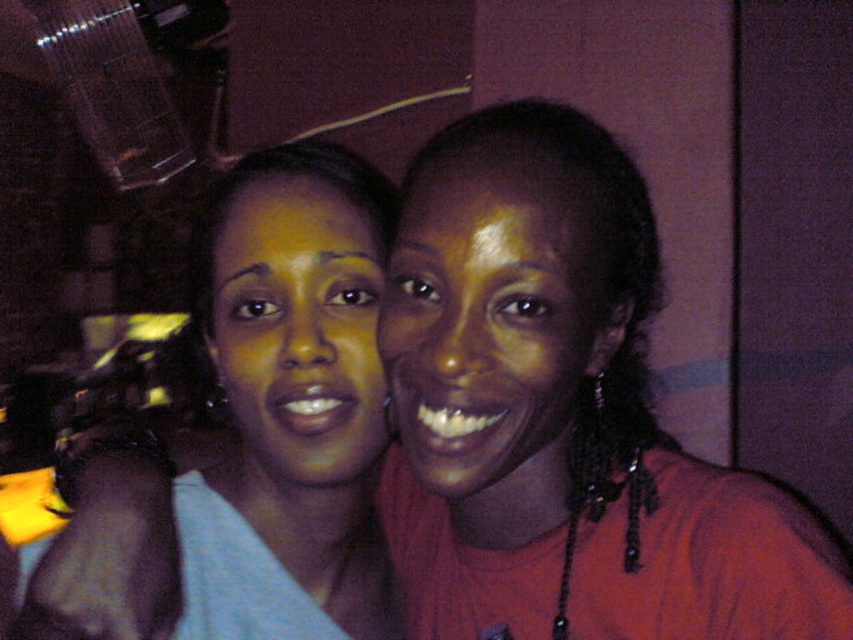
Question: Can you confirm if matte red shirt at center is smaller than matte blue shirt at left?

Choices:
 (A) no
 (B) yes

Answer: (A)

Question: Does matte gold face at center have a lesser width compared to matte yellow face at center?

Choices:
 (A) no
 (B) yes

Answer: (B)

Question: Which of the following is the farthest from the observer?

Choices:
 (A) (581, 148)
 (B) (213, 250)

Answer: (B)

Question: Which point appears farthest from the camera in this image?

Choices:
 (A) (274, 248)
 (B) (506, 637)
 (C) (486, 256)

Answer: (B)

Question: Is matte red shirt at center to the left of matte blue shirt at left from the viewer's perspective?

Choices:
 (A) no
 (B) yes

Answer: (A)

Question: Which point is farther from the camera taking this photo?

Choices:
 (A) (585, 563)
 (B) (345, 212)
 (C) (460, 262)
 (D) (270, 620)

Answer: (D)